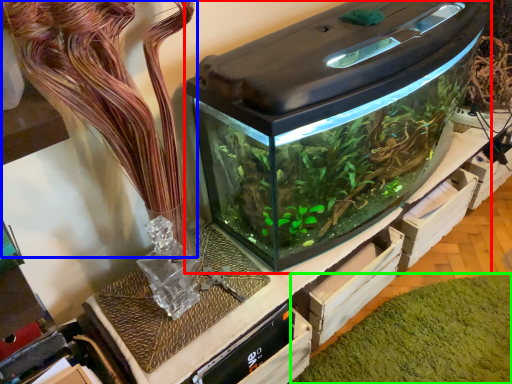
Question: Which object is positioned closest to home appliance (highlighted by a red box)? Select from plant (highlighted by a blue box) and algae (highlighted by a green box).

Choices:
 (A) plant
 (B) algae

Answer: (A)